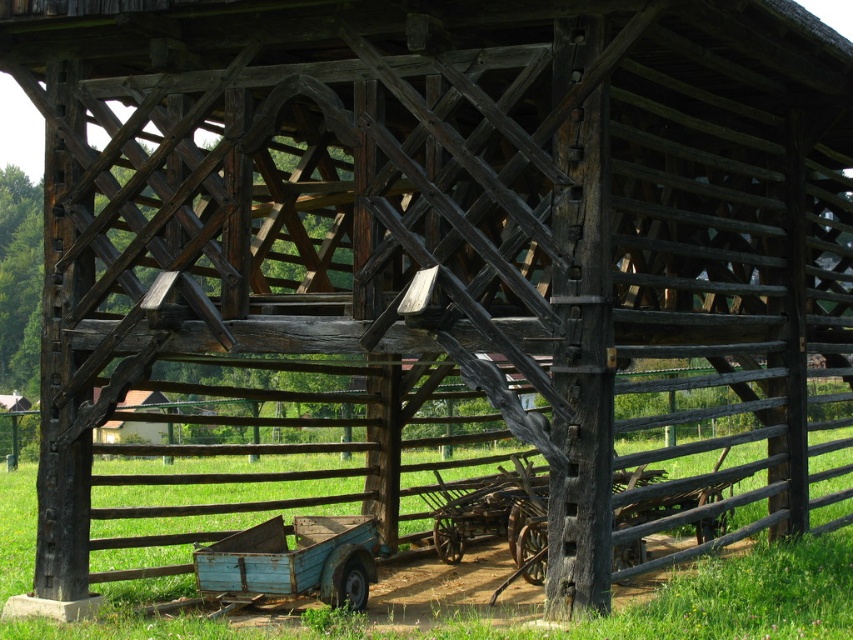
Which is more to the left, rusty wooden wagon at lower center or brown wooden fence at center?

Positioned to the left is rusty wooden wagon at lower center.

Is rusty wooden wagon at lower center below brown wooden fence at center?

Yes.

Describe the element at coordinates (294, 561) in the screenshot. I see `rusty wooden wagon at lower center` at that location.

Where is `rusty wooden wagon at lower center`? rusty wooden wagon at lower center is located at coordinates (294, 561).